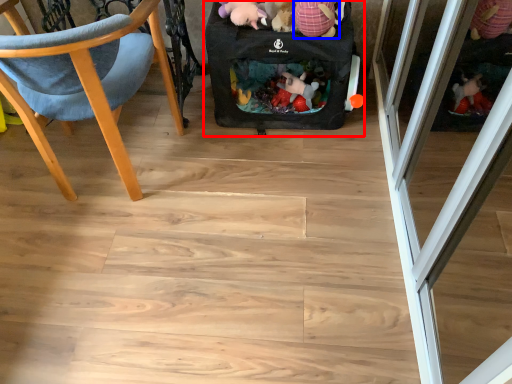
Question: Which point is further to the camera, baby carriage (highlighted by a red box) or toy (highlighted by a blue box)?

Choices:
 (A) baby carriage
 (B) toy

Answer: (A)